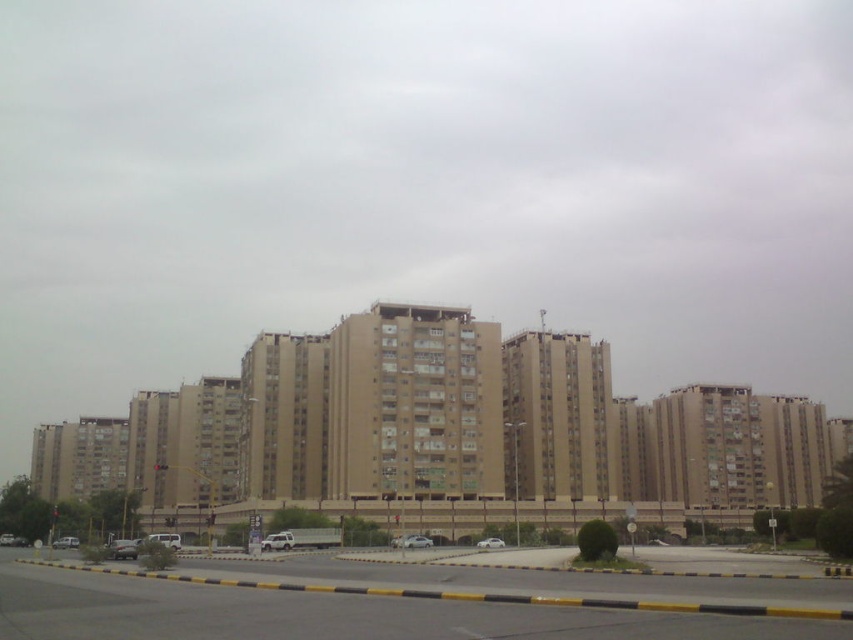
You are a delivery driver who needs to park your vehicle in this area. You have a silver metallic car at lower left and a silver metallic van at center in view. Which vehicle would require more space to park without overlapping other parked vehicles?

The silver metallic van at center requires more space to park because it is larger than the silver metallic car at lower left.

You are a pedestrian standing on the sidewalk near the black and yellow striped curb. You need to cross the road to reach the residential buildings. Which vehicle, the silver metallic car at lower left or the silver metallic van at center, is closer to the curb where you are standing?

The silver metallic car at lower left is closer to the curb because it is positioned on the left side of the silver metallic van at center, and since you are on the left side of the van, the car is nearer to your position.